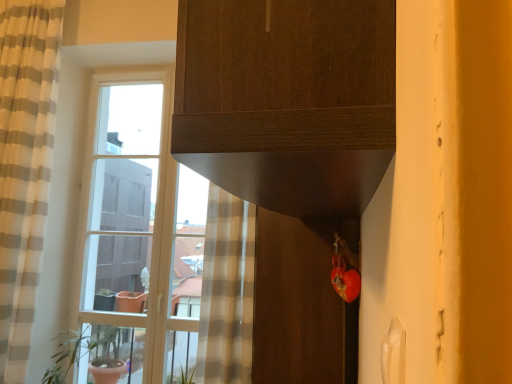
Question: Is clear glass window at left to the left of matte brown screen door at lower center from the viewer's perspective?

Choices:
 (A) no
 (B) yes

Answer: (B)

Question: Can we say clear glass window at left lies outside matte brown screen door at lower center?

Choices:
 (A) yes
 (B) no

Answer: (A)

Question: From a real-world perspective, is clear glass window at left physically above matte brown screen door at lower center?

Choices:
 (A) yes
 (B) no

Answer: (A)

Question: Is there a large distance between clear glass window at left and matte brown screen door at lower center?

Choices:
 (A) yes
 (B) no

Answer: (A)

Question: From a real-world perspective, is clear glass window at left physically below matte brown screen door at lower center?

Choices:
 (A) yes
 (B) no

Answer: (B)

Question: From the image's perspective, is clear glass window at left above matte brown screen door at lower center?

Choices:
 (A) no
 (B) yes

Answer: (B)

Question: From a real-world perspective, is matte brown screen door at lower center below clear glass window at left?

Choices:
 (A) no
 (B) yes

Answer: (B)

Question: Is matte brown screen door at lower center looking in the opposite direction of clear glass window at left?

Choices:
 (A) yes
 (B) no

Answer: (B)

Question: Does matte brown screen door at lower center lie behind clear glass window at left?

Choices:
 (A) no
 (B) yes

Answer: (A)

Question: Does matte brown screen door at lower center have a greater height compared to clear glass window at left?

Choices:
 (A) no
 (B) yes

Answer: (A)

Question: Is matte brown screen door at lower center to the left of clear glass window at left from the viewer's perspective?

Choices:
 (A) yes
 (B) no

Answer: (B)

Question: Considering the relative sizes of matte brown screen door at lower center and clear glass window at left in the image provided, is matte brown screen door at lower center bigger than clear glass window at left?

Choices:
 (A) no
 (B) yes

Answer: (B)

Question: Considering the relative sizes of green matte plant pot at left and matte brown screen door at lower center in the image provided, is green matte plant pot at left bigger than matte brown screen door at lower center?

Choices:
 (A) no
 (B) yes

Answer: (A)